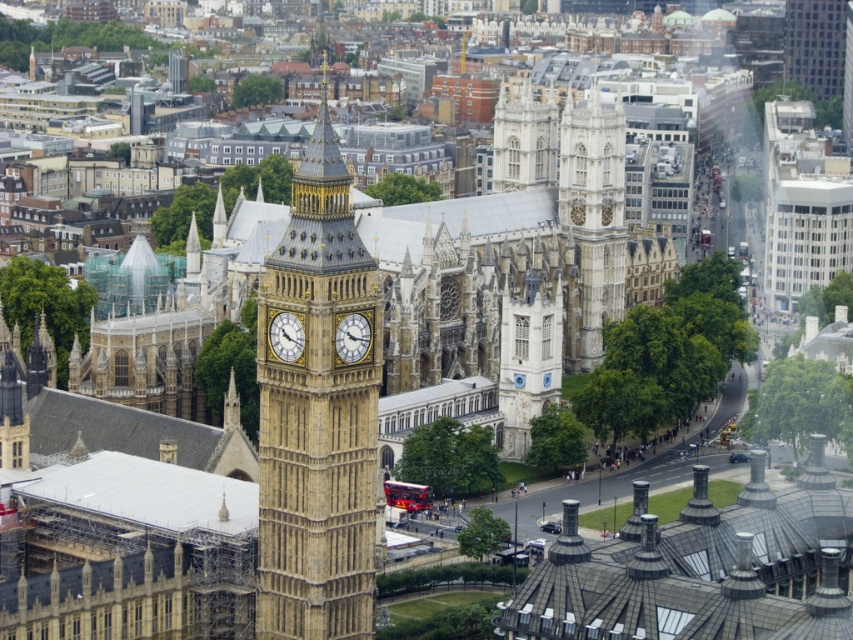
Question: Can you confirm if golden stone clock tower at center is positioned above gold metallic clock at center?

Choices:
 (A) no
 (B) yes

Answer: (B)

Question: Which is farther from the golden stone clock tower at center?

Choices:
 (A) gold metallic clock at center
 (B) white stone clock tower at center-right
 (C) gold textured clock at center

Answer: (B)

Question: Which point is farther from the camera taking this photo?

Choices:
 (A) (606, 113)
 (B) (346, 362)
 (C) (303, 330)
 (D) (259, 452)

Answer: (A)

Question: Is white stone clock tower at center-right positioned behind gold textured clock at center?

Choices:
 (A) yes
 (B) no

Answer: (A)

Question: Which object appears farthest from the camera in this image?

Choices:
 (A) golden stone clock tower at center
 (B) white stone clock tower at center-right
 (C) gold metallic clock at center

Answer: (B)

Question: Can you confirm if gold metallic clock at center is positioned to the left of gold textured clock at center?

Choices:
 (A) no
 (B) yes

Answer: (B)